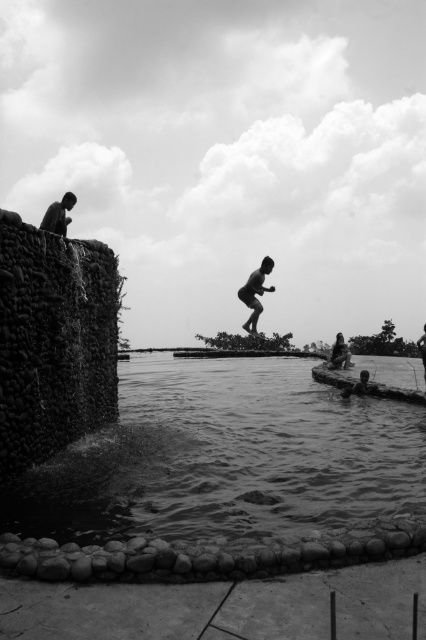
You are a photographer trying to capture the entire scene in one shot. Given that the smooth water at lower center and the smooth skin man at center are both in your frame, which object takes up more space in the photo?

The smooth skin man at center takes up more space in the photo because the smooth water at lower center occupies less space than the smooth skin man at center.

You are standing at the edge of the natural pool and see two points marked in the scene. Which point, point (201, 444) or point (247, 324), is closer to you?

Point (201, 444) is closer to the viewer than point (247, 324).